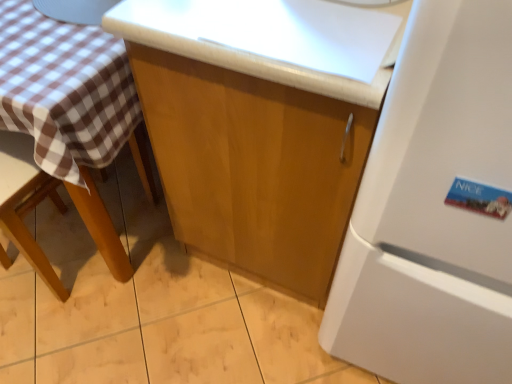
Question: Is glossy wood cabinet at center taller than white matte refrigerator at right?

Choices:
 (A) no
 (B) yes

Answer: (A)

Question: Would you say glossy wood cabinet at center is outside white matte refrigerator at right?

Choices:
 (A) no
 (B) yes

Answer: (B)

Question: From the image's perspective, is glossy wood cabinet at center located beneath white matte refrigerator at right?

Choices:
 (A) no
 (B) yes

Answer: (A)

Question: From a real-world perspective, is glossy wood cabinet at center located higher than white matte refrigerator at right?

Choices:
 (A) no
 (B) yes

Answer: (A)

Question: Is white matte refrigerator at right completely or partially inside glossy wood cabinet at center?

Choices:
 (A) yes
 (B) no

Answer: (B)

Question: From the image's perspective, is brown wooden chair at left located above or below white matte refrigerator at right?

Choices:
 (A) below
 (B) above

Answer: (A)

Question: Would you say brown wooden chair at left is to the left or to the right of white matte refrigerator at right in the picture?

Choices:
 (A) right
 (B) left

Answer: (B)

Question: In terms of width, does brown wooden chair at left look wider or thinner when compared to white matte refrigerator at right?

Choices:
 (A) wide
 (B) thin

Answer: (B)

Question: In the image, is brown wooden chair at left positioned in front of or behind white matte refrigerator at right?

Choices:
 (A) behind
 (B) front

Answer: (A)

Question: Would you say glossy wood cabinet at center is to the left or to the right of brown wooden chair at left in the picture?

Choices:
 (A) left
 (B) right

Answer: (B)

Question: Choose the correct answer: Is glossy wood cabinet at center inside brown wooden chair at left or outside it?

Choices:
 (A) inside
 (B) outside

Answer: (B)

Question: From their relative heights in the image, would you say glossy wood cabinet at center is taller or shorter than brown wooden chair at left?

Choices:
 (A) short
 (B) tall

Answer: (B)

Question: Considering the positions of glossy wood cabinet at center and brown wooden chair at left in the image, is glossy wood cabinet at center wider or thinner than brown wooden chair at left?

Choices:
 (A) thin
 (B) wide

Answer: (B)

Question: From a real-world perspective, is white matte refrigerator at right physically located above or below brown wooden chair at left?

Choices:
 (A) below
 (B) above

Answer: (B)

Question: Considering the positions of point (x=478, y=102) and point (x=5, y=266), is point (x=478, y=102) closer or farther from the camera than point (x=5, y=266)?

Choices:
 (A) farther
 (B) closer

Answer: (B)